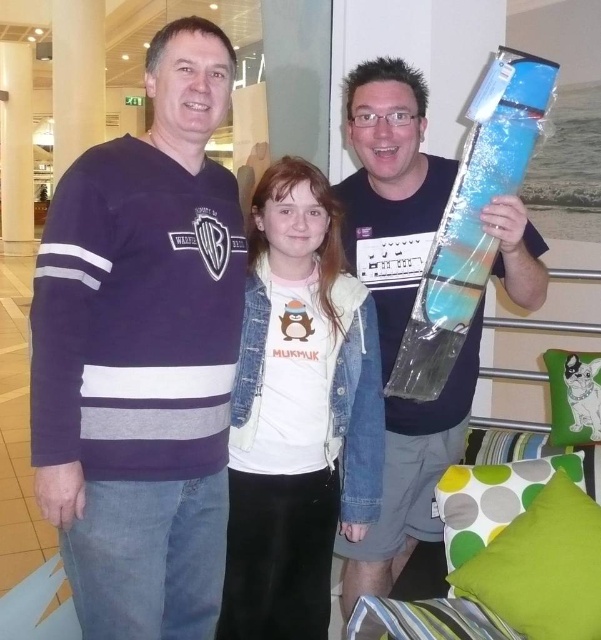
Who is more distant from viewer, (88,595) or (325,358)?

Point (325,358)

Who is more forward, (198, 586) or (337, 451)?

Point (198, 586) is more forward.

Image resolution: width=601 pixels, height=640 pixels. Find the location of `purple jersey at left`. purple jersey at left is located at coordinates (142, 355).

Does purple jersey at left have a smaller size compared to blue plastic guitar at center?

Indeed, purple jersey at left has a smaller size compared to blue plastic guitar at center.

Between purple jersey at left and blue plastic guitar at center, which one has more height?

Standing taller between the two is blue plastic guitar at center.

At what (x,y) coordinates should I click in order to perform the action: click on purple jersey at left. Please return your answer as a coordinate pair (x, y). Image resolution: width=601 pixels, height=640 pixels. Looking at the image, I should click on (142, 355).

Locate an element on the screen. purple jersey at left is located at coordinates (142, 355).

Based on the photo, can you confirm if white cotton t-shirt at center is positioned below blue plastic guitar at center?

Yes.

Is white cotton t-shirt at center above blue plastic guitar at center?

Actually, white cotton t-shirt at center is below blue plastic guitar at center.

Between point (269, 353) and point (418, 410), which one is positioned behind?

The point (418, 410) is behind.

Where is `white cotton t-shirt at center`? The image size is (601, 640). white cotton t-shirt at center is located at coordinates (299, 413).